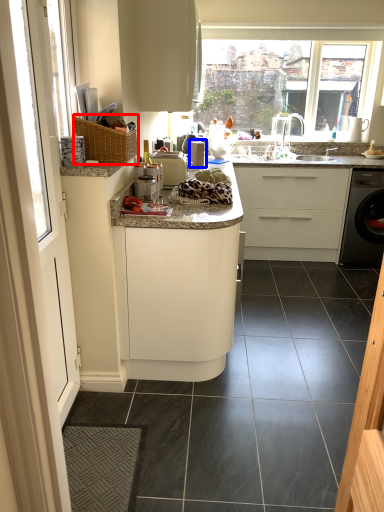
Question: Which object is closer to the camera taking this photo, basket (highlighted by a red box) or appliance (highlighted by a blue box)?

Choices:
 (A) basket
 (B) appliance

Answer: (A)